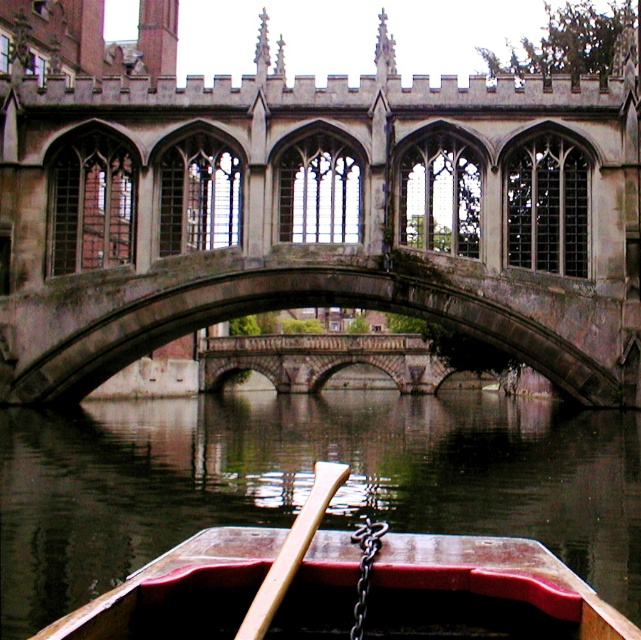
Question: Which of these objects is positioned farthest from the wooden canoe at center?

Choices:
 (A) wooden at center
 (B) dark water at center

Answer: (B)

Question: Which point is closer to the camera?

Choices:
 (A) stone gothic bridge at center
 (B) dark water at center
 (C) wooden at center

Answer: (C)

Question: Estimate the real-world distances between objects in this image. Which object is closer to the wooden at center?

Choices:
 (A) stone gothic bridge at center
 (B) dark water at center

Answer: (B)

Question: Is stone gothic bridge at center further to camera compared to dark water at center?

Choices:
 (A) no
 (B) yes

Answer: (B)

Question: Does dark water at center appear on the left side of wooden at center?

Choices:
 (A) yes
 (B) no

Answer: (B)

Question: Is dark water at center thinner than wooden at center?

Choices:
 (A) no
 (B) yes

Answer: (A)